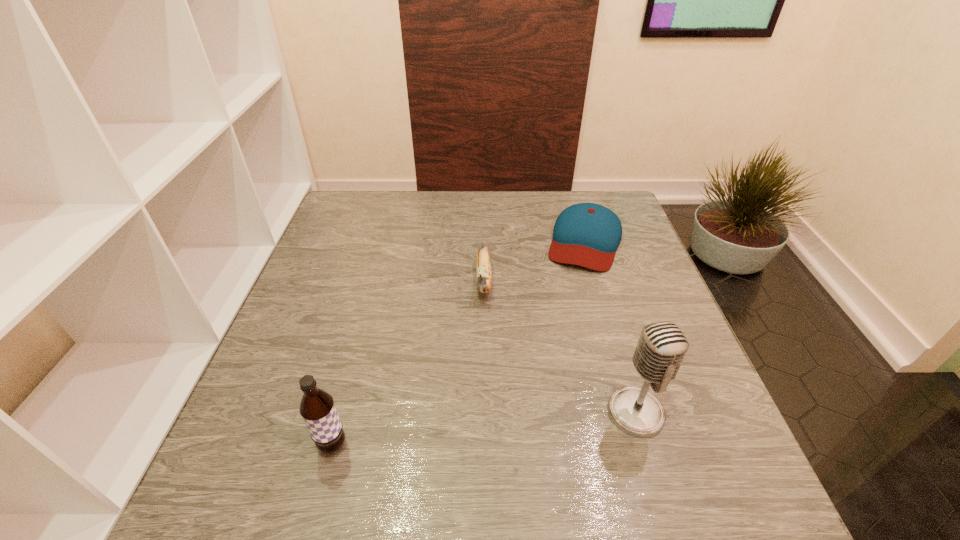
Locate an element on the screen. Image resolution: width=960 pixels, height=540 pixels. the second tallest object is located at coordinates (317, 408).

In order to click on the leftmost object in this screenshot , I will do `click(317, 408)`.

The height and width of the screenshot is (540, 960). I want to click on microphone, so click(x=662, y=346).

You are a GUI agent. You are given a task and a screenshot of the screen. Output one action in this format:
    pyautogui.click(x=<x>, y=<y>)
    Task: Click on the baseball cap
    The width and height of the screenshot is (960, 540).
    Given the screenshot: What is the action you would take?
    (585, 234)

Identify the location of the third object from right to left. The width and height of the screenshot is (960, 540). (483, 267).

You are a GUI agent. You are given a task and a screenshot of the screen. Output one action in this format:
    pyautogui.click(x=<x>, y=<y>)
    Task: Click on the banana
    
    Given the screenshot: What is the action you would take?
    pyautogui.click(x=483, y=267)

At what (x,y) coordinates should I click in order to perform the action: click on free point located 0.050m on the left of the root beer. Please return your answer as a coordinate pair (x, y). Looking at the image, I should click on (290, 446).

The width and height of the screenshot is (960, 540). I want to click on vacant space located on the back of the tallest object, so click(x=605, y=310).

The height and width of the screenshot is (540, 960). In order to click on vacant space located 0.340m with the bill of the baseball cap facing forward in this screenshot , I will do `click(551, 372)`.

Identify the location of vacant area situated with the bill of the baseball cap facing forward. This screenshot has width=960, height=540. (552, 368).